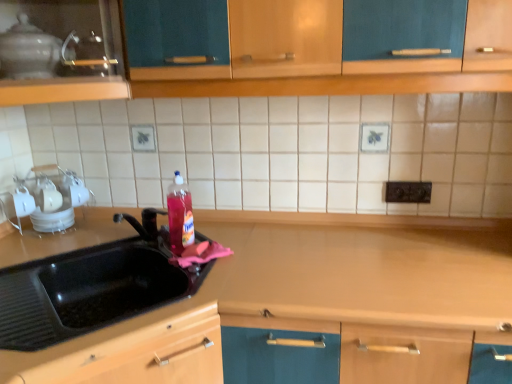
Locate an element on the screen. free spot above black rubber sink at left (from a real-world perspective) is located at coordinates click(x=96, y=247).